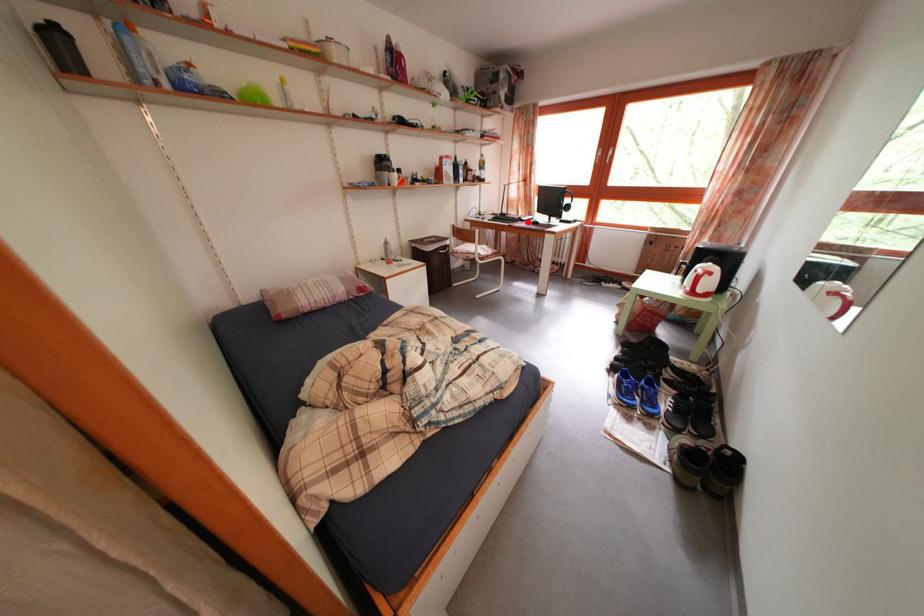
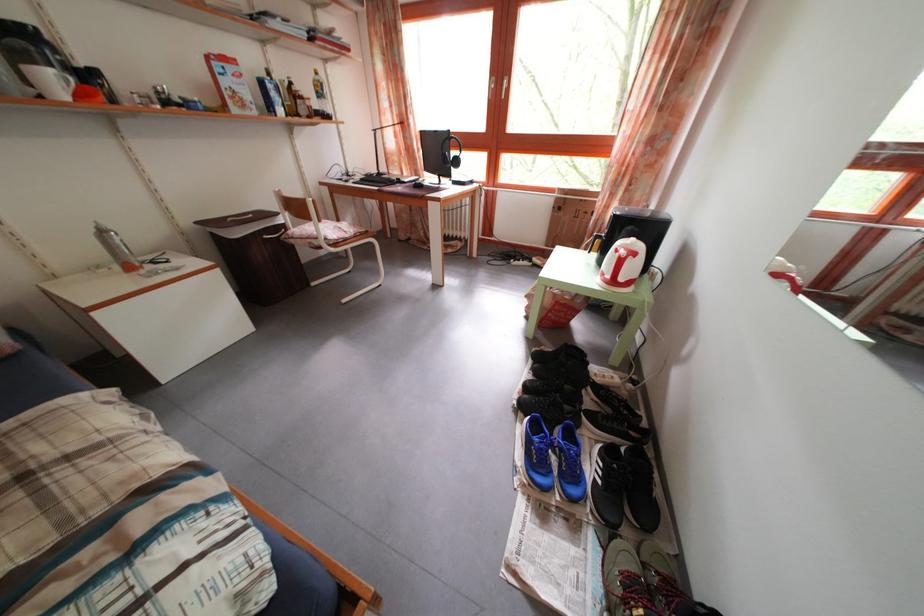
Where in the second image is the point corresponding to the highlighted location from the first image?

(412, 182)